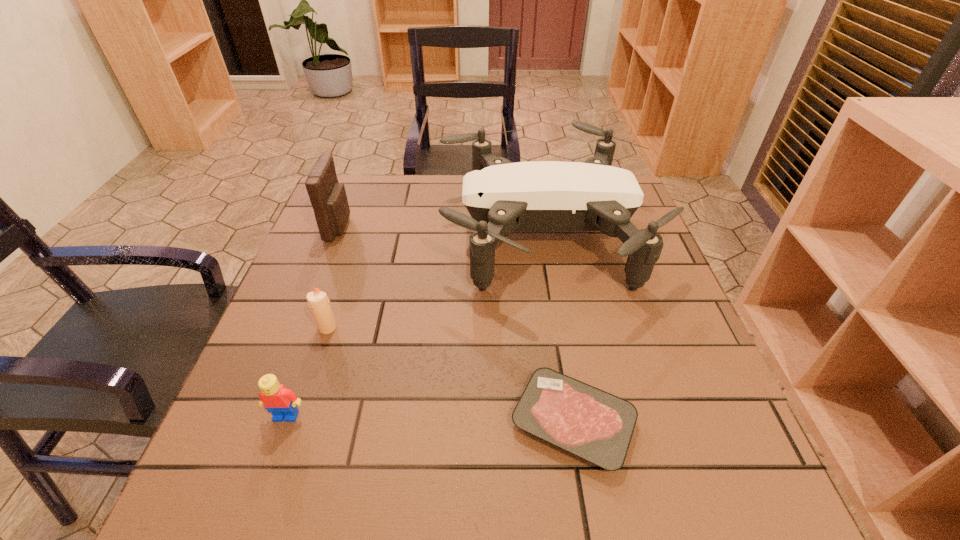
Locate an element on the screen. Image resolution: width=960 pixels, height=540 pixels. drone is located at coordinates (501, 196).

Where is `pouch`? Image resolution: width=960 pixels, height=540 pixels. pouch is located at coordinates (328, 198).

You are a GUI agent. You are given a task and a screenshot of the screen. Output one action in this format:
    pyautogui.click(x=<x>, y=<y>)
    Task: Click on the candle
    
    Given the screenshot: What is the action you would take?
    pyautogui.click(x=318, y=301)

At what (x,y) coordinates should I click in order to perform the action: click on Lego. Please return your answer as a coordinate pair (x, y). Looking at the image, I should click on (281, 402).

Find the location of a particular element. This screenshot has height=540, width=960. steak is located at coordinates (597, 426).

Locate an element on the screen. This screenshot has height=540, width=960. free space located 0.130m on the camera side of the drone is located at coordinates (390, 233).

Locate an element on the screen. The height and width of the screenshot is (540, 960). vacant space located on the camera side of the drone is located at coordinates (315, 233).

I want to click on blank space located on the camera side of the drone, so click(417, 233).

You are a GUI agent. You are given a task and a screenshot of the screen. Output one action in this format:
    pyautogui.click(x=<x>, y=<y>)
    Task: Click on the vacant space located with an open flap on the pouch
    The image size is (960, 540).
    Given the screenshot: What is the action you would take?
    pyautogui.click(x=384, y=226)

The height and width of the screenshot is (540, 960). In order to click on vacant space positioned on the back of the candle in this screenshot , I will do `click(337, 297)`.